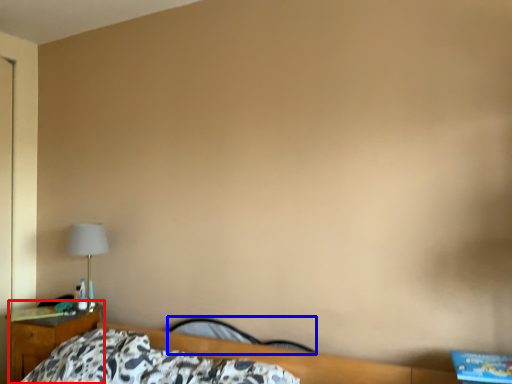
Question: Among these objects, which one is nearest to the camera, nightstand (highlighted by a red box) or chair (highlighted by a blue box)?

Choices:
 (A) nightstand
 (B) chair

Answer: (B)